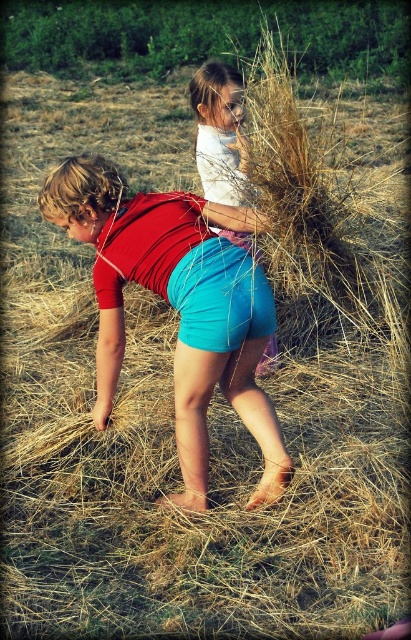
Question: Which point is closer to the camera?

Choices:
 (A) tap(228, 230)
 (B) tap(106, 424)

Answer: (B)

Question: Is the position of teal fabric shorts at center less distant than that of matte white shirt at upper center?

Choices:
 (A) yes
 (B) no

Answer: (A)

Question: Among these objects, which one is nearest to the camera?

Choices:
 (A) matte white shirt at upper center
 (B) matte blue shorts at center

Answer: (B)

Question: Can you confirm if matte blue shorts at center is wider than teal fabric shorts at center?

Choices:
 (A) no
 (B) yes

Answer: (B)

Question: Which of the following is the farthest from the observer?

Choices:
 (A) teal fabric shorts at center
 (B) matte blue shorts at center

Answer: (B)

Question: In this image, where is teal fabric shorts at center located relative to matte white shirt at upper center?

Choices:
 (A) below
 (B) above

Answer: (A)